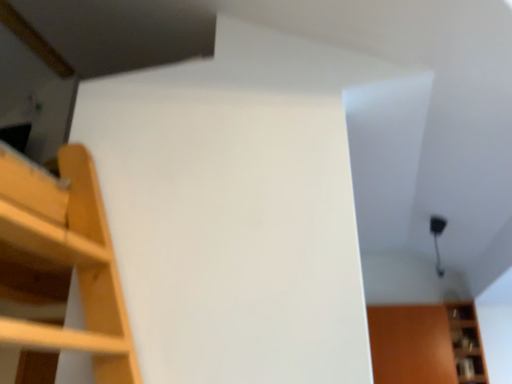
Question: From the image's perspective, would you say wooden at lower right is positioned over matte brown cabinet at lower right?

Choices:
 (A) no
 (B) yes

Answer: (B)

Question: Is wooden at lower right at the left side of matte brown cabinet at lower right?

Choices:
 (A) no
 (B) yes

Answer: (A)

Question: Is matte brown cabinet at lower right surrounded by wooden at lower right?

Choices:
 (A) yes
 (B) no

Answer: (B)

Question: From the image's perspective, would you say wooden at lower right is shown under matte brown cabinet at lower right?

Choices:
 (A) no
 (B) yes

Answer: (A)

Question: Can you confirm if wooden at lower right is positioned to the right of matte brown cabinet at lower right?

Choices:
 (A) no
 (B) yes

Answer: (B)

Question: Are wooden at lower right and matte brown cabinet at lower right located far from each other?

Choices:
 (A) yes
 (B) no

Answer: (B)

Question: Considering the relative positions of matte brown cabinet at lower right and wooden at lower right in the image provided, is matte brown cabinet at lower right to the right of wooden at lower right from the viewer's perspective?

Choices:
 (A) yes
 (B) no

Answer: (B)

Question: Does matte brown cabinet at lower right lie in front of wooden at lower right?

Choices:
 (A) no
 (B) yes

Answer: (A)

Question: Considering the relative sizes of matte brown cabinet at lower right and wooden at lower right in the image provided, is matte brown cabinet at lower right thinner than wooden at lower right?

Choices:
 (A) yes
 (B) no

Answer: (B)

Question: Is matte brown cabinet at lower right bigger than wooden at lower right?

Choices:
 (A) yes
 (B) no

Answer: (A)

Question: Is matte brown cabinet at lower right not near wooden at lower right?

Choices:
 (A) no
 (B) yes

Answer: (A)

Question: Can you confirm if matte brown cabinet at lower right is smaller than wooden at lower right?

Choices:
 (A) no
 (B) yes

Answer: (A)

Question: In terms of width, does wooden at lower right look wider or thinner when compared to matte brown cabinet at lower right?

Choices:
 (A) wide
 (B) thin

Answer: (B)